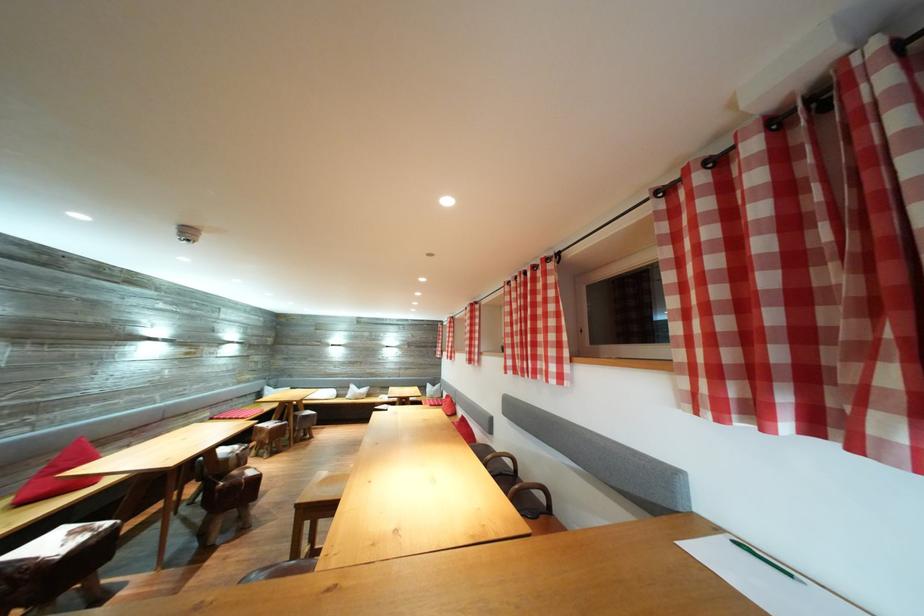
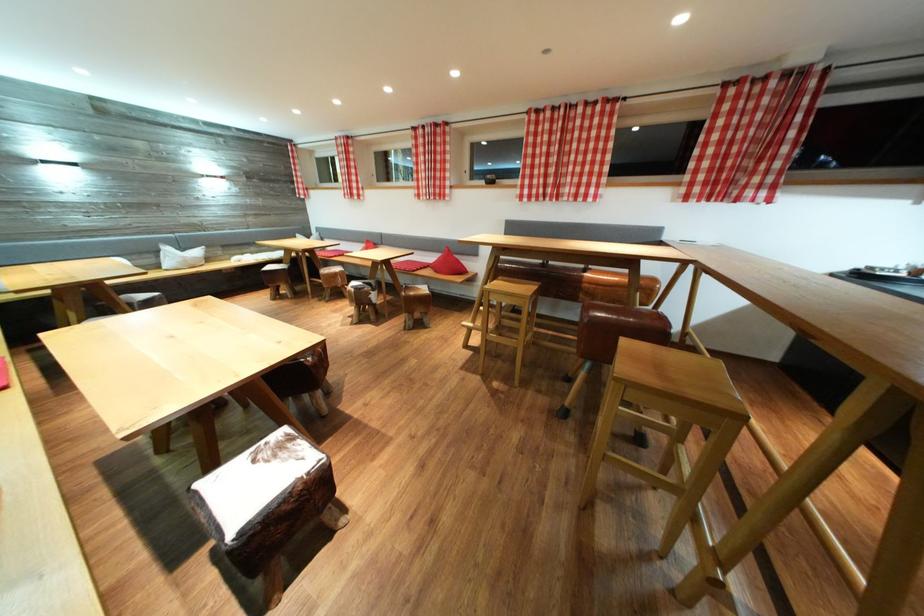
Locate, in the second image, the point that corresponds to point 359,392 in the first image.

(176, 254)